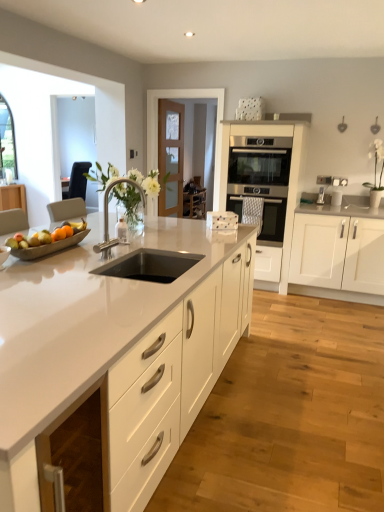
Identify the location of vacant space positioned to the left of polished chrome faucet at center. This screenshot has width=384, height=512. (81, 260).